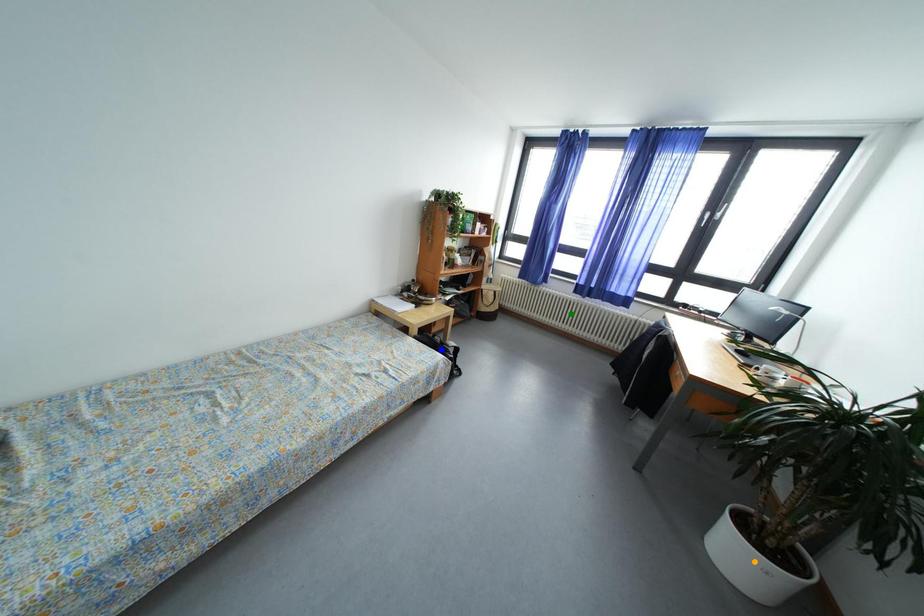
Order these from nearest to farthest:
orange point
green point
blue point

green point, blue point, orange point